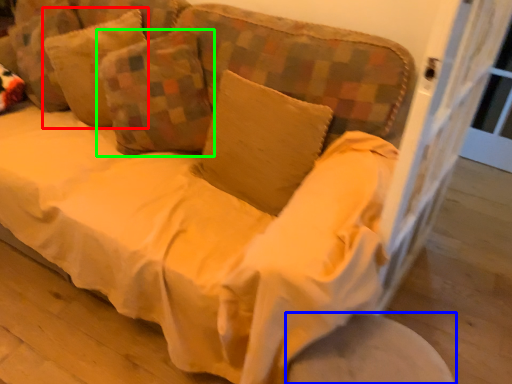
Question: Which is nearer to the pillow (highlighted by a red box)? round table (highlighted by a blue box) or pillow (highlighted by a green box).

Choices:
 (A) round table
 (B) pillow

Answer: (B)